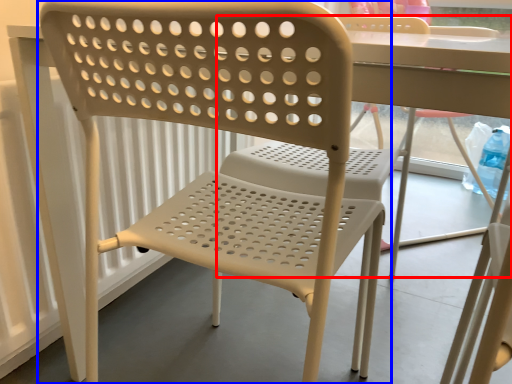
Question: Which of the following is the farthest to the observer, chair (highlighted by a red box) or chair (highlighted by a blue box)?

Choices:
 (A) chair
 (B) chair

Answer: (A)